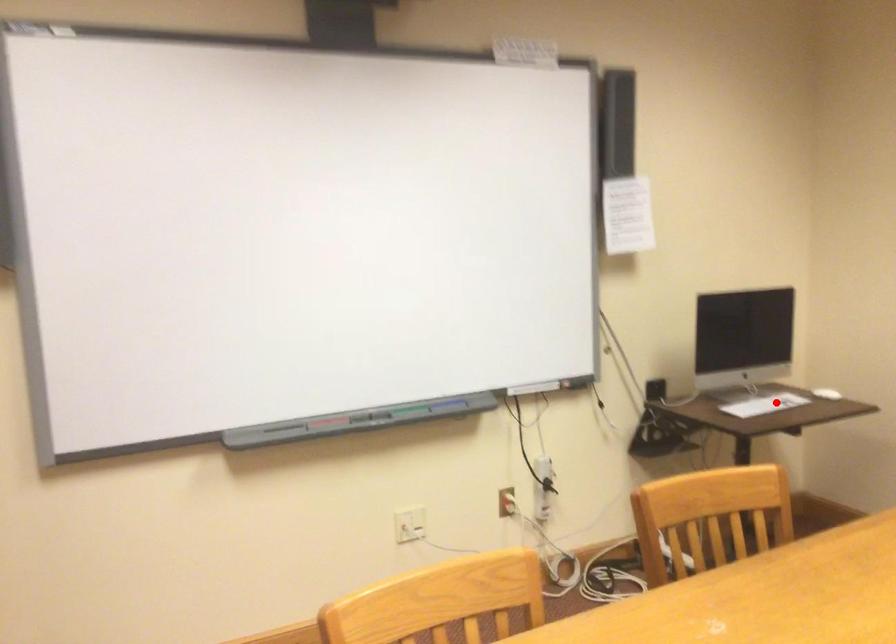
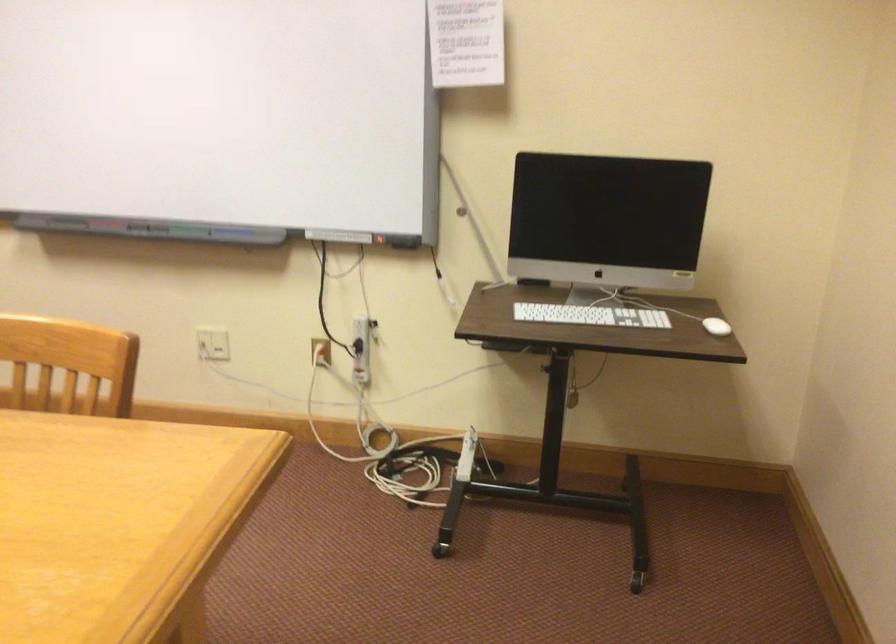
Question: I am providing you with two images of the same scene from different viewpoints. Image1 has a red point marked. In image2, the corresponding 3D location appears at what relative position? Reply with the corresponding letter.

Choices:
 (A) Closer
 (B) Farther

Answer: (A)